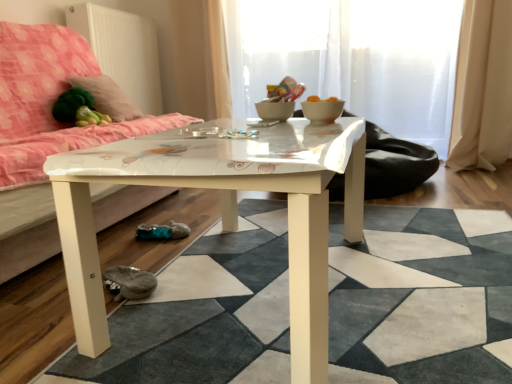
Question: Is point (245, 104) closer or farther from the camera than point (313, 109)?

Choices:
 (A) farther
 (B) closer

Answer: (A)

Question: From their relative heights in the image, would you say transparent glass door at center, which is the first glass door in front-to-back order, is taller or shorter than white glossy bowl at center?

Choices:
 (A) tall
 (B) short

Answer: (A)

Question: Considering the real-world distances, which object is closest to the matte pink fabric couch at left?

Choices:
 (A) white glossy bowl at center
 (B) white glossy coffee table at center
 (C) fluffy pink pillow at upper left
 (D) transparent glass door at upper center, which appears as the 1th glass door when viewed from the back
 (E) beige fabric curtain at right

Answer: (C)

Question: Estimate the real-world distances between objects in this image. Which object is closer to the transparent glass door at center, which is the first glass door in front-to-back order?

Choices:
 (A) gray suede shoe at lower left
 (B) white glossy bowl at center
 (C) white glossy table at center
 (D) matte pink fabric couch at left
 (E) beige fabric curtain at right

Answer: (E)